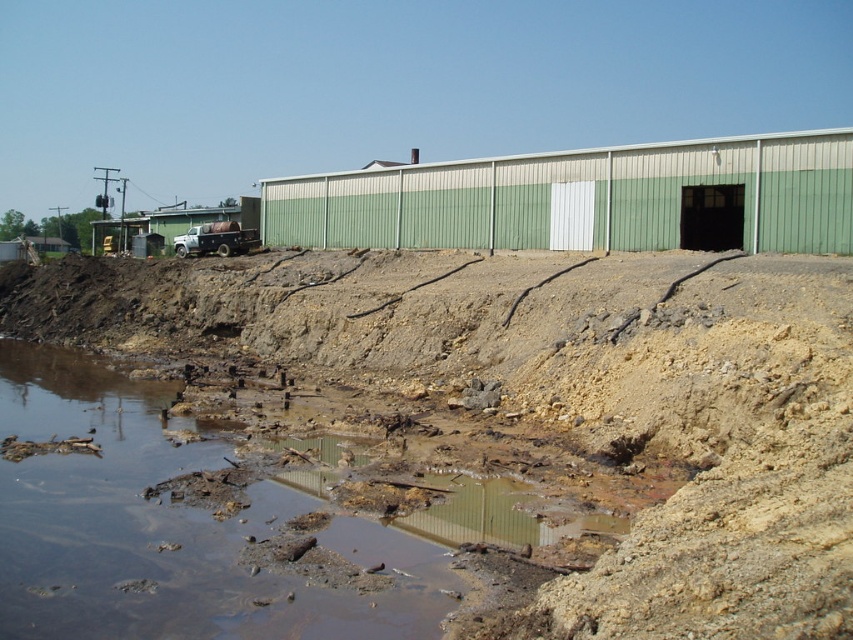
Who is lower down, dull brown dirt at lower left or muddy water at lower left?

Positioned lower is muddy water at lower left.

Which of these two, dull brown dirt at lower left or muddy water at lower left, stands taller?

Standing taller between the two is dull brown dirt at lower left.

The image size is (853, 640). Describe the element at coordinates (561, 400) in the screenshot. I see `dull brown dirt at lower left` at that location.

Identify the location of dull brown dirt at lower left. The height and width of the screenshot is (640, 853). (561, 400).